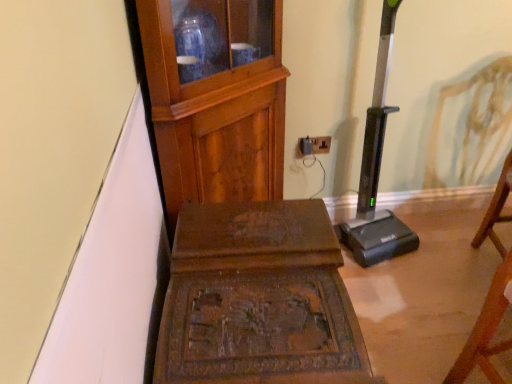
Question: Considering the relative sizes of wooden chair at right, arranged as the third furniture when viewed from the left, and carved wood table at center, the second furniture in the right-to-left sequence, in the image provided, is wooden chair at right, arranged as the third furniture when viewed from the left, shorter than carved wood table at center, the second furniture in the right-to-left sequence,?

Choices:
 (A) yes
 (B) no

Answer: (B)

Question: From a real-world perspective, is wooden chair at right, which appears as the first furniture when viewed from the right, physically below carved wood table at center, marked as the second furniture in a left-to-right arrangement?

Choices:
 (A) no
 (B) yes

Answer: (A)

Question: Does wooden chair at right, arranged as the third furniture when viewed from the left, have a lesser width compared to carved wood table at center, the second furniture in the right-to-left sequence?

Choices:
 (A) yes
 (B) no

Answer: (A)

Question: Could you tell me if wooden chair at right, arranged as the third furniture when viewed from the left, is turned towards carved wood table at center, marked as the second furniture in a left-to-right arrangement?

Choices:
 (A) no
 (B) yes

Answer: (A)

Question: Does wooden chair at right, arranged as the third furniture when viewed from the left, have a larger size compared to carved wood table at center, the second furniture in the right-to-left sequence?

Choices:
 (A) yes
 (B) no

Answer: (B)

Question: In terms of height, does wooden cabinet at upper left, which is counted as the third furniture, starting from the right, look taller or shorter compared to wooden chair at right, arranged as the third furniture when viewed from the left?

Choices:
 (A) tall
 (B) short

Answer: (A)

Question: Is wooden cabinet at upper left, the 1th furniture viewed from the left, in front of or behind wooden chair at right, arranged as the third furniture when viewed from the left, in the image?

Choices:
 (A) behind
 (B) front

Answer: (A)

Question: Considering the positions of wooden cabinet at upper left, which is counted as the third furniture, starting from the right, and wooden chair at right, arranged as the third furniture when viewed from the left, in the image, is wooden cabinet at upper left, which is counted as the third furniture, starting from the right, bigger or smaller than wooden chair at right, arranged as the third furniture when viewed from the left,?

Choices:
 (A) big
 (B) small

Answer: (A)

Question: Would you say wooden cabinet at upper left, which is counted as the third furniture, starting from the right, is to the left or to the right of wooden chair at right, arranged as the third furniture when viewed from the left, in the picture?

Choices:
 (A) left
 (B) right

Answer: (A)

Question: Is black plastic outlet at center situated inside carved wood table at center, marked as the second furniture in a left-to-right arrangement, or outside?

Choices:
 (A) inside
 (B) outside

Answer: (B)

Question: From their relative heights in the image, would you say black plastic outlet at center is taller or shorter than carved wood table at center, marked as the second furniture in a left-to-right arrangement?

Choices:
 (A) short
 (B) tall

Answer: (A)

Question: Considering the relative positions of black plastic outlet at center and carved wood table at center, the second furniture in the right-to-left sequence, in the image provided, is black plastic outlet at center to the left or to the right of carved wood table at center, the second furniture in the right-to-left sequence,?

Choices:
 (A) left
 (B) right

Answer: (B)

Question: From a real-world perspective, relative to carved wood table at center, marked as the second furniture in a left-to-right arrangement, is black plastic outlet at center vertically above or below?

Choices:
 (A) below
 (B) above

Answer: (B)

Question: Considering the positions of carved wood table at center, marked as the second furniture in a left-to-right arrangement, and wooden cabinet at upper left, the 1th furniture viewed from the left, in the image, is carved wood table at center, marked as the second furniture in a left-to-right arrangement, wider or thinner than wooden cabinet at upper left, the 1th furniture viewed from the left,?

Choices:
 (A) thin
 (B) wide

Answer: (B)

Question: Would you say carved wood table at center, marked as the second furniture in a left-to-right arrangement, is inside or outside wooden cabinet at upper left, the 1th furniture viewed from the left?

Choices:
 (A) inside
 (B) outside

Answer: (B)